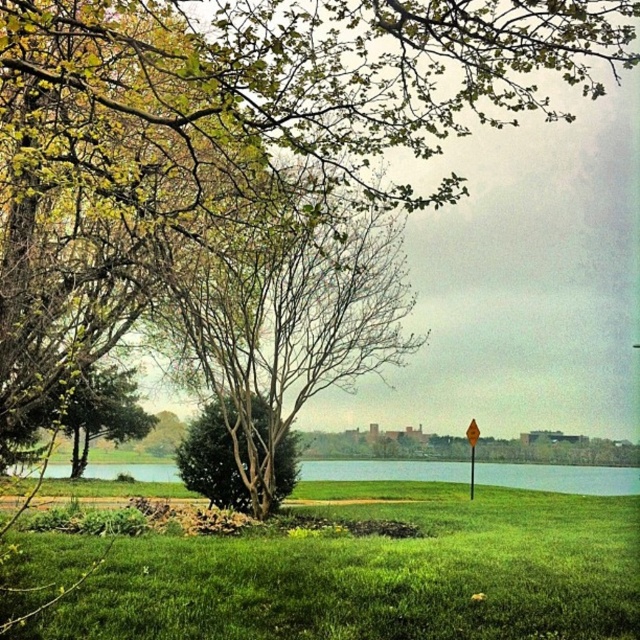
You are standing in the middle of the green grassy water at center and want to reach the yellow plastic street sign at upper center. Which direction should you walk to get closer to the sign?

The yellow plastic street sign at upper center is taller than the green grassy water at center, so you should walk towards the upper center direction to get closer to the sign.

You are standing at the center of the grassy area and want to plant a new flower bed. The green leafy tree at center is in your way. Can you move the tree to the left to make space for the flower bed?

The green leafy tree at center is located at point 0.439, so moving it to the left would require adjusting its position to a coordinate less than 0.439 to create space for the flower bed.

You are standing in the outdoor scene and want to walk from the green grassy water at center to the yellow plastic street sign at upper center. Which direction should you move to get closer to the sign?

To get closer to the yellow plastic street sign at upper center, you should move forward since the green grassy water at center is further away from you than the sign.